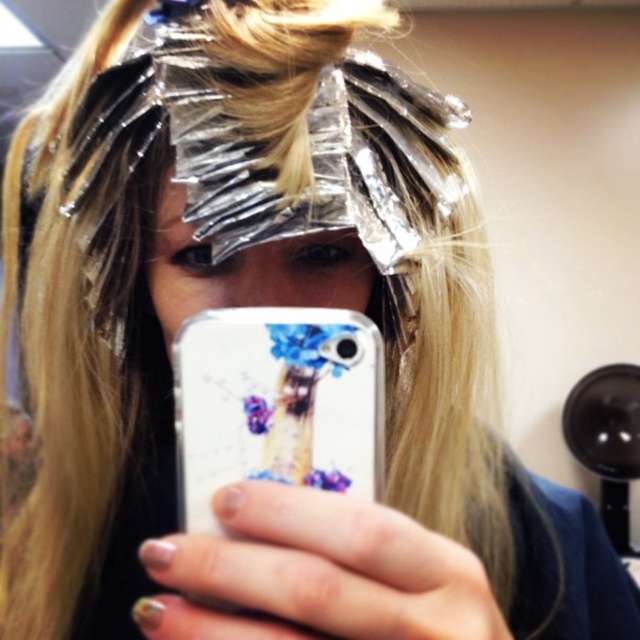
Question: Which point appears closest to the camera in this image?

Choices:
 (A) (308, 384)
 (B) (296, 305)

Answer: (A)

Question: Which point is closer to the camera taking this photo?

Choices:
 (A) (278, 305)
 (B) (200, 449)

Answer: (B)

Question: Is white glossy phone case at center to the right of matte plastic face at center from the viewer's perspective?

Choices:
 (A) no
 (B) yes

Answer: (B)

Question: Does white glossy phone case at center appear over matte plastic face at center?

Choices:
 (A) yes
 (B) no

Answer: (B)

Question: Which object appears farthest from the camera in this image?

Choices:
 (A) white glossy phone case at center
 (B) matte plastic face at center

Answer: (B)

Question: Is white glossy phone case at center positioned at the back of matte plastic face at center?

Choices:
 (A) no
 (B) yes

Answer: (A)